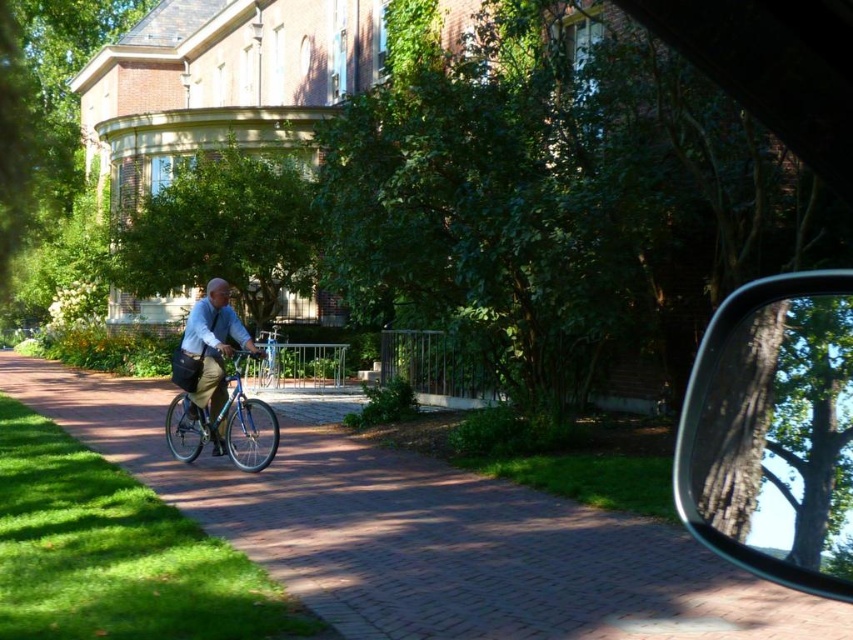
You are standing at the origin point of the coordinate system. You want to move towards the shiny blue bicycle at center. What are the coordinates you need to move to reach it?

The coordinates to reach the shiny blue bicycle at center are point (x=224, y=426).

You are standing at the point closer to the camera in the image. The two points are labeled as point (129, 468) and point (257, 371). Which point are you standing at?

You are standing at point (129, 468) because it is closer to the camera than point (257, 371).

You are a photographer trying to capture the shiny blue bicycle at center and the light blue fabric shirt at center in a single frame. Given that the bicycle is larger than the shirt, how should you position your camera to ensure both objects are clearly visible in the photo?

Since the shiny blue bicycle at center is larger in size than the light blue fabric shirt at center, position the camera closer to the shirt and farther from the bicycle to balance their sizes in the frame.